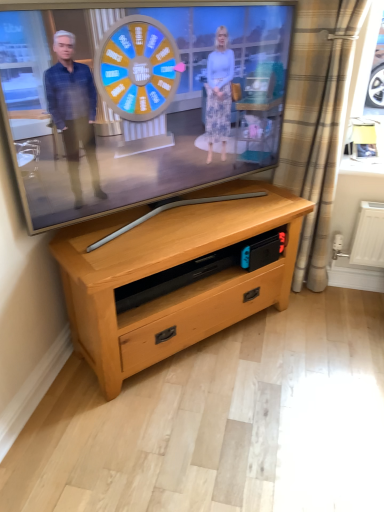
Locate an element on the screen. The height and width of the screenshot is (512, 384). vacant space to the right of light wood chest of drawers at center is located at coordinates (316, 348).